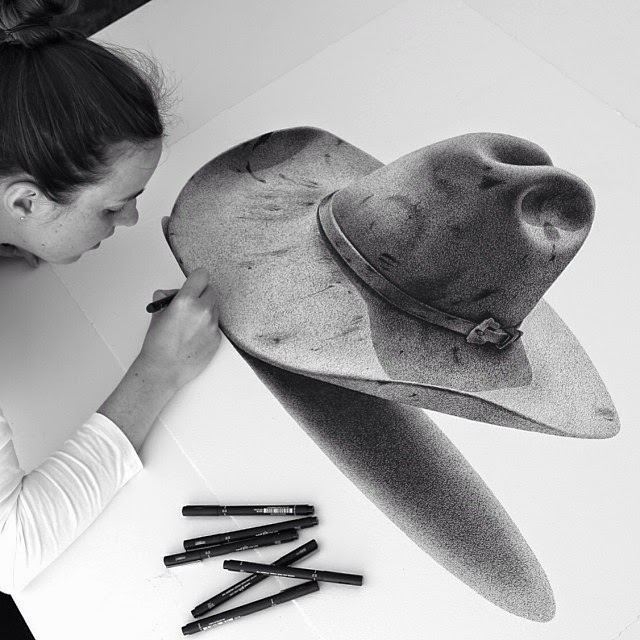
Find the location of a particular element. black pen or pencils is located at coordinates (300, 596).